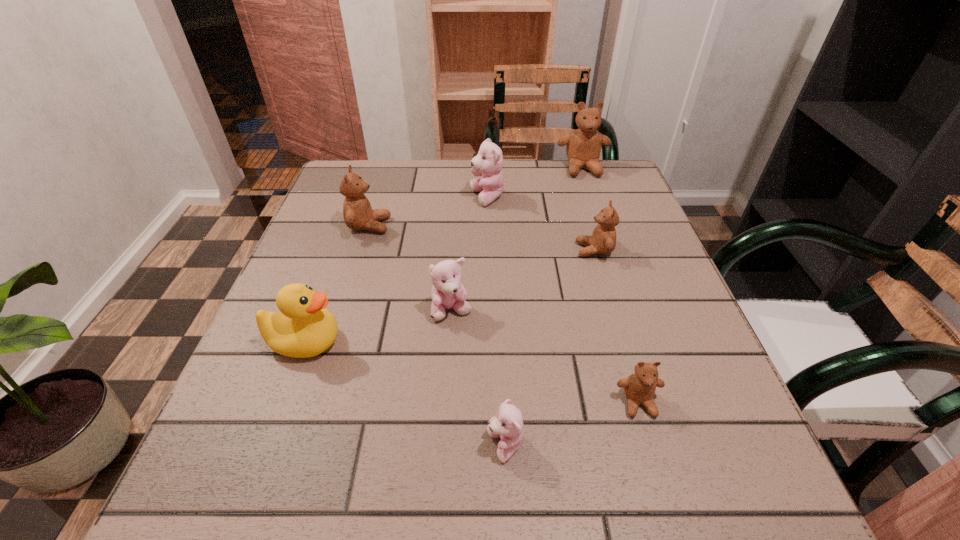
Find the location of a particular element. This screenshot has width=960, height=540. duck that is at the left edge is located at coordinates (303, 328).

You are a GUI agent. You are given a task and a screenshot of the screen. Output one action in this format:
    pyautogui.click(x=<x>, y=<y>)
    Task: Click on the object that is at the far right corner
    This screenshot has width=960, height=540.
    Given the screenshot: What is the action you would take?
    pyautogui.click(x=583, y=148)

Where is `vacant space at the far edge`? This screenshot has width=960, height=540. vacant space at the far edge is located at coordinates (541, 175).

Identify the location of free space at the left edge. (328, 273).

The width and height of the screenshot is (960, 540). I want to click on free space at the right edge of the desktop, so point(655,255).

You are a GUI agent. You are given a task and a screenshot of the screen. Output one action in this format:
    pyautogui.click(x=<x>, y=<y>)
    Task: Click on the free space at the far right corner of the desktop
    The width and height of the screenshot is (960, 540).
    Given the screenshot: What is the action you would take?
    pyautogui.click(x=611, y=162)

At what (x,y) coordinates should I click in order to perform the action: click on empty space between the second biggest pink teddy bear and the farthest teddy bear. Please return your answer as a coordinate pair (x, y). Looking at the image, I should click on (517, 240).

Where is `blank region between the second farthest pink teddy bear and the farthest pink teddy bear`? This screenshot has height=540, width=960. blank region between the second farthest pink teddy bear and the farthest pink teddy bear is located at coordinates (469, 254).

Where is `free space between the farthest object and the duck`? free space between the farthest object and the duck is located at coordinates (444, 255).

The image size is (960, 540). Find the location of `vacant area that lies between the second smallest pink teddy bear and the nearest pink teddy bear`. vacant area that lies between the second smallest pink teddy bear and the nearest pink teddy bear is located at coordinates (479, 378).